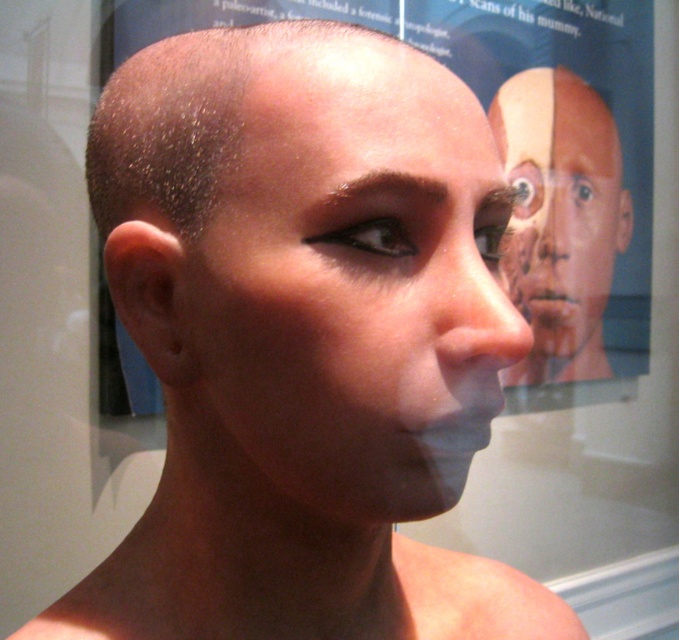
Which is more to the right, smooth skin head at center or matte skin face at center?

matte skin face at center is more to the right.

Is smooth skin head at center below matte skin face at center?

Indeed, smooth skin head at center is positioned under matte skin face at center.

Between point (268, 216) and point (538, 211), which one is positioned in front?

Positioned in front is point (268, 216).

Where is `smooth skin head at center`? This screenshot has height=640, width=679. smooth skin head at center is located at coordinates pos(310,259).